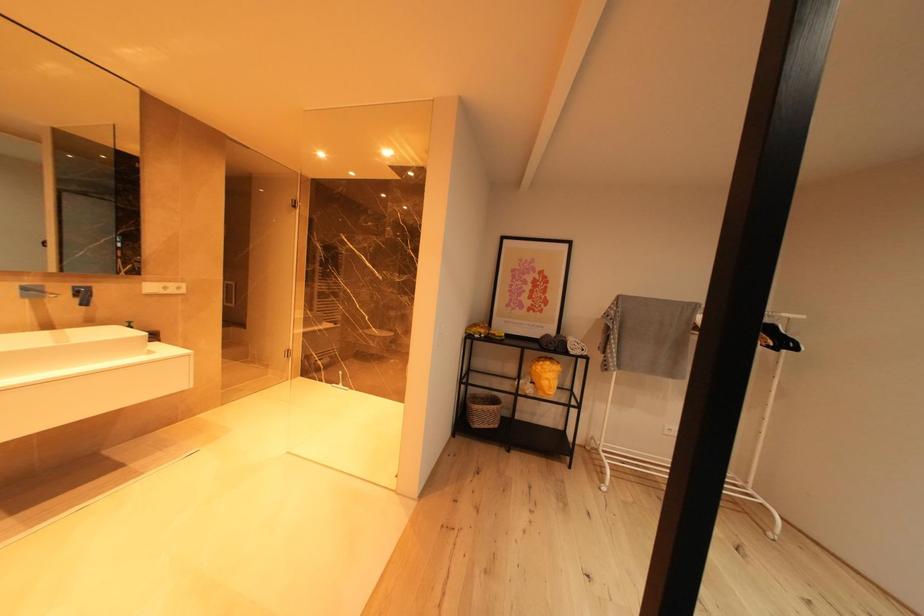
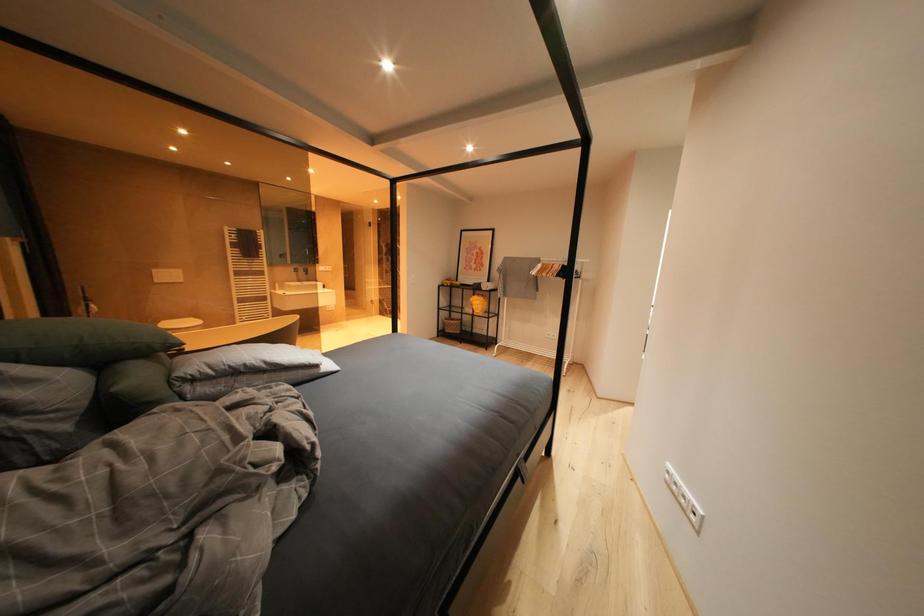
Which direction would the cameraman need to move to produce the second image?

The movement direction of the cameraman is right, backward.